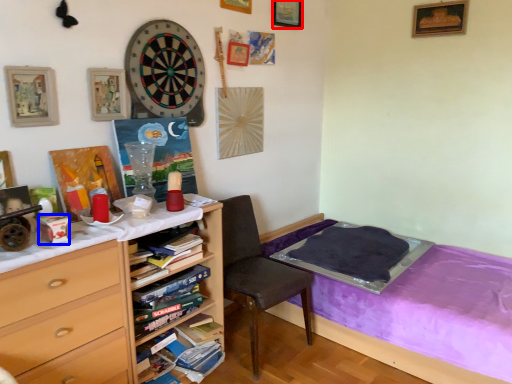
Question: Which object is further to the camera taking this photo, picture frame (highlighted by a red box) or box (highlighted by a blue box)?

Choices:
 (A) picture frame
 (B) box

Answer: (A)